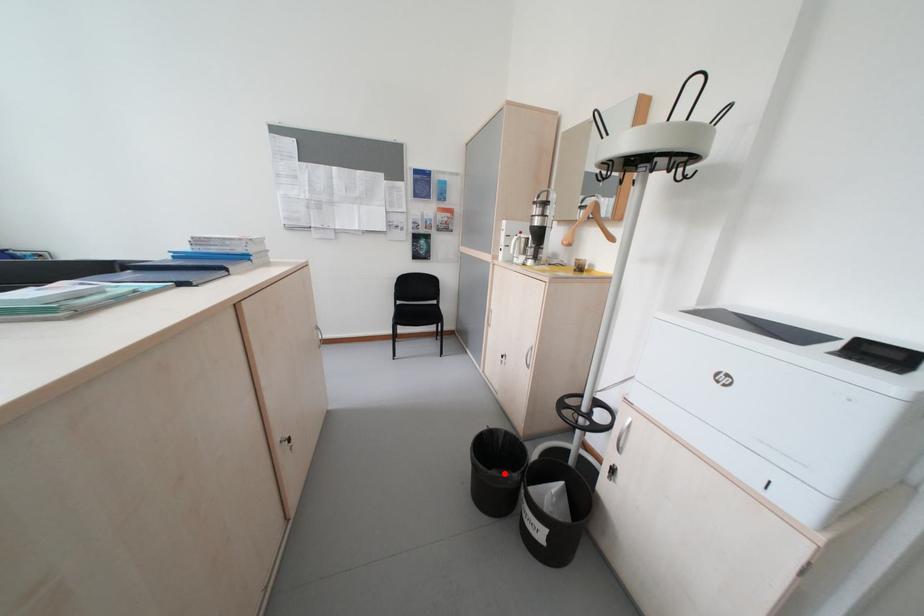
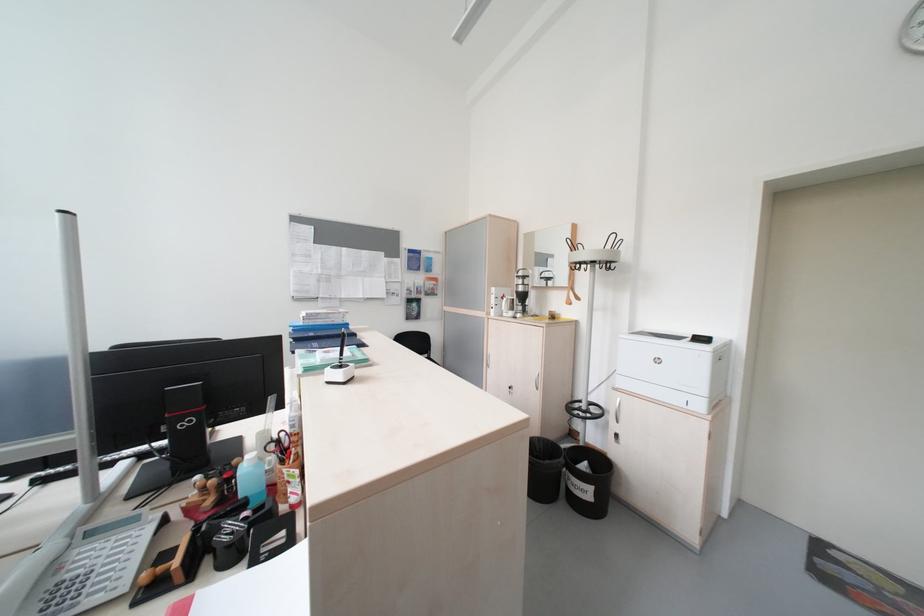
The point at the highlighted location is marked in the first image. Where is the corresponding point in the second image?

(557, 464)